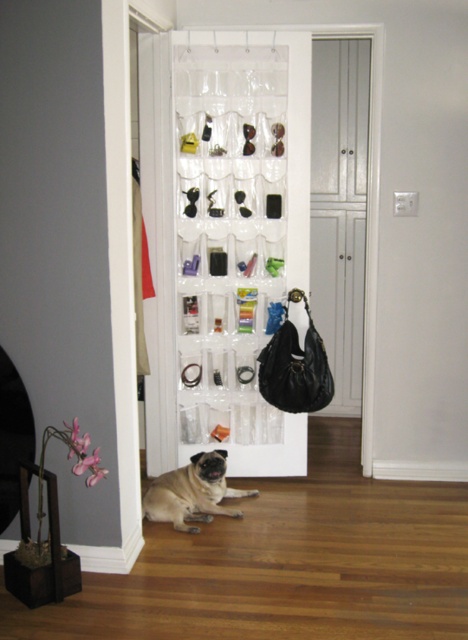
Between clear plastic organizer at center and black leather handbag at center, which one appears on the right side from the viewer's perspective?

Positioned to the right is black leather handbag at center.

Which is behind, point (177, 296) or point (313, 344)?

The point (177, 296) is more distant.

Where is `clear plastic organizer at center`? The width and height of the screenshot is (468, 640). clear plastic organizer at center is located at coordinates (239, 237).

Does clear plastic organizer at center have a larger size compared to light brown fur at center?

Correct, clear plastic organizer at center is larger in size than light brown fur at center.

Who is positioned more to the left, clear plastic organizer at center or light brown fur at center?

light brown fur at center

What do you see at coordinates (239, 237) in the screenshot? I see `clear plastic organizer at center` at bounding box center [239, 237].

The height and width of the screenshot is (640, 468). I want to click on clear plastic organizer at center, so click(x=239, y=237).

Can you confirm if black leather handbag at center is positioned above light brown fur at center?

Yes.

Is black leather handbag at center shorter than light brown fur at center?

In fact, black leather handbag at center may be taller than light brown fur at center.

At what (x,y) coordinates should I click in order to perform the action: click on black leather handbag at center. Please return your answer as a coordinate pair (x, y). This screenshot has height=640, width=468. Looking at the image, I should click on (294, 365).